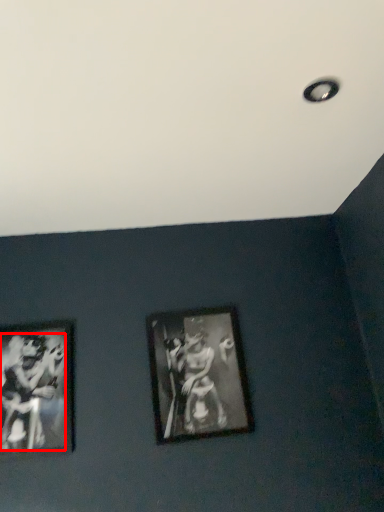
Question: From the image's perspective, where is person (annotated by the red box) located in relation to picture frame in the image?

Choices:
 (A) above
 (B) below

Answer: (B)